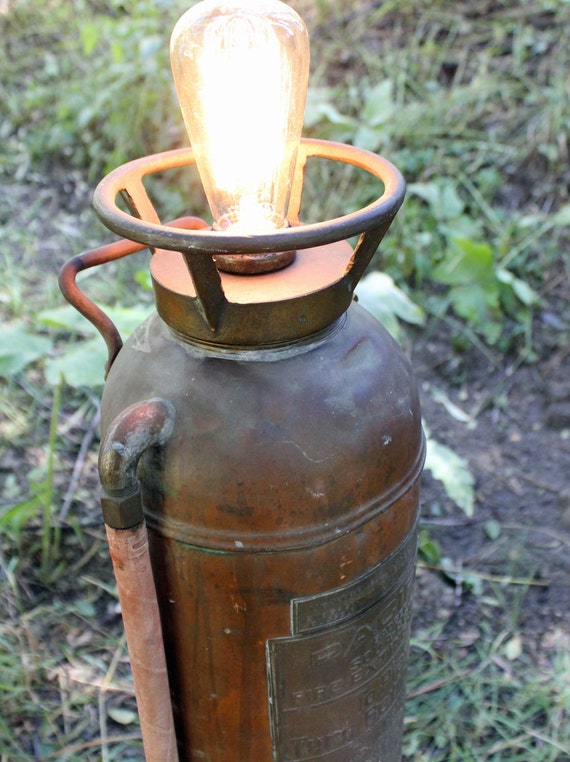
At what (x,y) coordinates should I click in order to perform the action: click on metal plaque. Please return your answer as a coordinate pair (x, y). The width and height of the screenshot is (570, 762). Looking at the image, I should click on (293, 666).